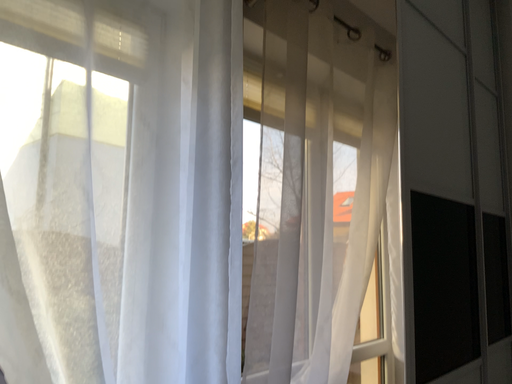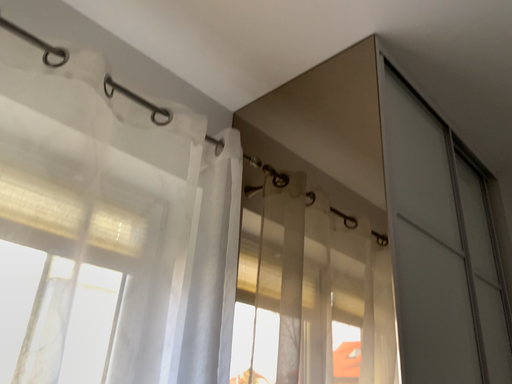
Question: Which way did the camera rotate in the video?

Choices:
 (A) rotated upward
 (B) rotated downward

Answer: (A)